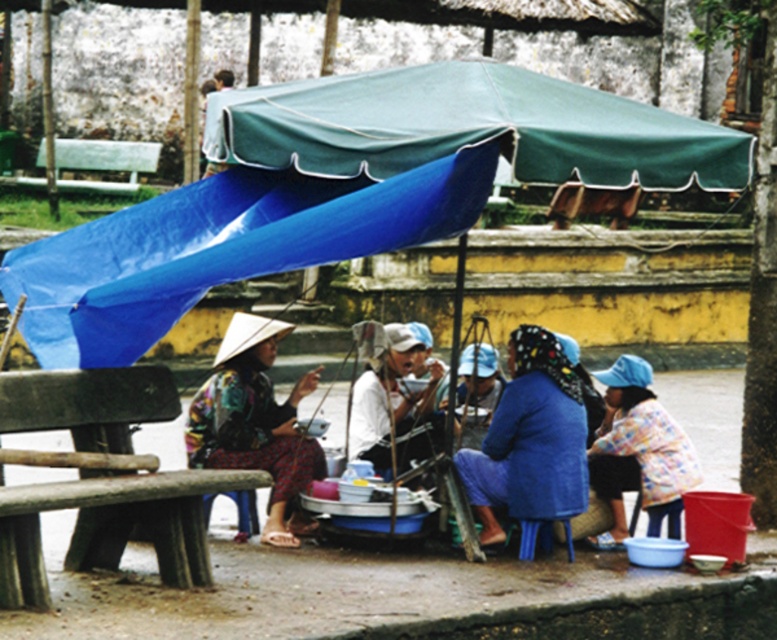
Question: Among these points, which one is farthest from the camera?

Choices:
 (A) (234, 326)
 (B) (63, 148)
 (C) (612, 541)
 (D) (493, 106)

Answer: (B)

Question: Which point is closer to the camera?

Choices:
 (A) (96, 164)
 (B) (579, 436)

Answer: (B)

Question: Is green fabric canopy at upper center closer to camera compared to white wooden bench at left?

Choices:
 (A) no
 (B) yes

Answer: (B)

Question: Does blue fabric headscarf at lower center appear under matte floral dress at center?

Choices:
 (A) yes
 (B) no

Answer: (A)

Question: Which of the following is the closest to the observer?

Choices:
 (A) (201, 438)
 (B) (133, 483)

Answer: (B)

Question: Does blue fabric headscarf at lower center appear on the right side of white wooden bench at left?

Choices:
 (A) no
 (B) yes

Answer: (B)